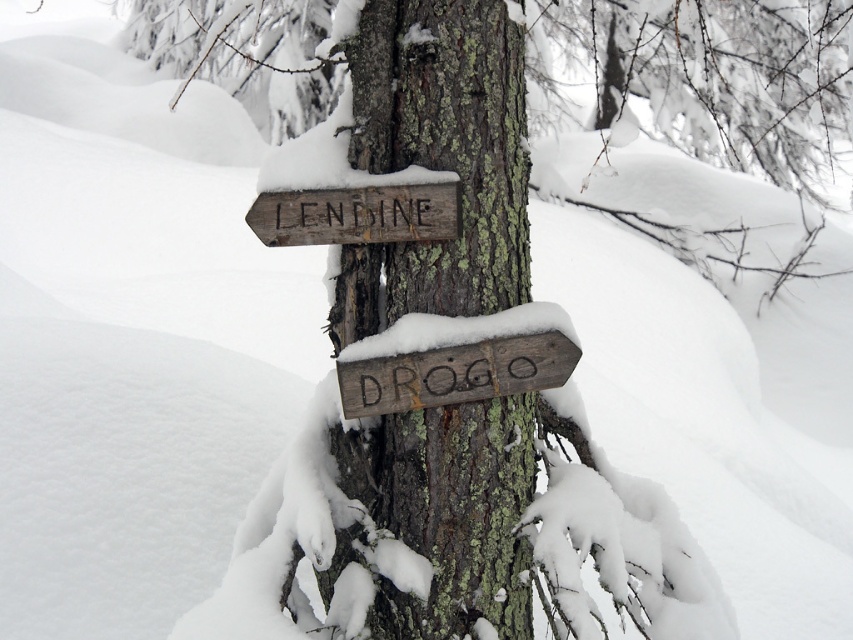
Question: Can you confirm if rough bark tree trunk at center is wider than weathered wood sign at upper center?

Choices:
 (A) yes
 (B) no

Answer: (A)

Question: Does rough bark tree trunk at center have a larger size compared to weathered wood sign at upper center?

Choices:
 (A) no
 (B) yes

Answer: (B)

Question: Which point is farther from the camera taking this photo?

Choices:
 (A) (361, 72)
 (B) (520, 362)

Answer: (A)

Question: Can you confirm if rough bark tree trunk at center is positioned above weathered wood sign at center?

Choices:
 (A) no
 (B) yes

Answer: (B)

Question: Among these points, which one is farthest from the camera?

Choices:
 (A) (489, 17)
 (B) (383, 224)

Answer: (A)

Question: Which point is farther to the camera?

Choices:
 (A) (544, 372)
 (B) (425, 230)
 (C) (392, 129)

Answer: (C)